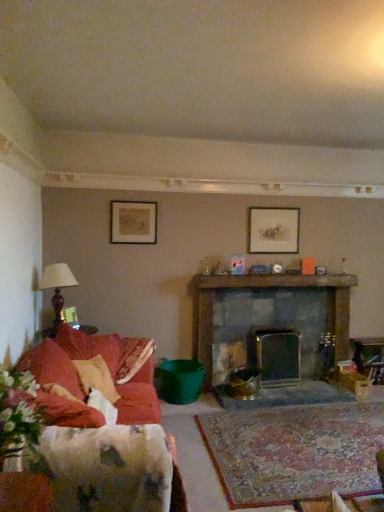
Question: Is velvet red couch at left touching matte silver picture frame at upper center, which is the first picture frame in back-to-front order?

Choices:
 (A) no
 (B) yes

Answer: (A)

Question: Can you confirm if velvet red couch at left is thinner than matte silver picture frame at upper center, which ranks as the third picture frame in front-to-back order?

Choices:
 (A) no
 (B) yes

Answer: (A)

Question: From the image's perspective, is velvet red couch at left under matte silver picture frame at upper center, the 2th picture frame in the bottom-to-top sequence?

Choices:
 (A) yes
 (B) no

Answer: (A)

Question: Is velvet red couch at left positioned in front of matte silver picture frame at upper center, positioned as the 2th picture frame in top-to-bottom order?

Choices:
 (A) yes
 (B) no

Answer: (A)

Question: Is velvet red couch at left facing away from matte silver picture frame at upper center, the 2th picture frame in the bottom-to-top sequence?

Choices:
 (A) yes
 (B) no

Answer: (B)

Question: Can you confirm if velvet red couch at left is bigger than matte silver picture frame at upper center, which ranks as the third picture frame in front-to-back order?

Choices:
 (A) no
 (B) yes

Answer: (B)

Question: Is dark gray stone fireplace at center, arranged as the 1th fireplace when viewed from the left, further to the viewer compared to matte black picture frame at upper left, which ranks as the 2th picture frame in right-to-left order?

Choices:
 (A) yes
 (B) no

Answer: (A)

Question: From the image's perspective, does dark gray stone fireplace at center, which is counted as the second fireplace, starting from the right, appear higher than matte black picture frame at upper left, acting as the 2th picture frame starting from the front?

Choices:
 (A) no
 (B) yes

Answer: (A)

Question: Considering the relative sizes of dark gray stone fireplace at center, arranged as the 1th fireplace when viewed from the left, and matte black picture frame at upper left, which appears as the 2th picture frame when viewed from the back, in the image provided, is dark gray stone fireplace at center, arranged as the 1th fireplace when viewed from the left, shorter than matte black picture frame at upper left, which appears as the 2th picture frame when viewed from the back,?

Choices:
 (A) yes
 (B) no

Answer: (B)

Question: Can you confirm if dark gray stone fireplace at center, which is counted as the second fireplace, starting from the right, is positioned to the left of matte black picture frame at upper left, which is counted as the 3th picture frame, starting from the bottom?

Choices:
 (A) no
 (B) yes

Answer: (A)

Question: Are dark gray stone fireplace at center, which is counted as the second fireplace, starting from the right, and matte black picture frame at upper left, which appears as the 2th picture frame when viewed from the back, far apart?

Choices:
 (A) no
 (B) yes

Answer: (B)

Question: Is dark gray stone fireplace at center, arranged as the 1th fireplace when viewed from the left, facing away from matte black picture frame at upper left, acting as the second picture frame starting from the left?

Choices:
 (A) no
 (B) yes

Answer: (A)

Question: Is velvet red couch at left positioned beyond the bounds of matte gold picture frame at left, which is counted as the third picture frame, starting from the top?

Choices:
 (A) yes
 (B) no

Answer: (A)